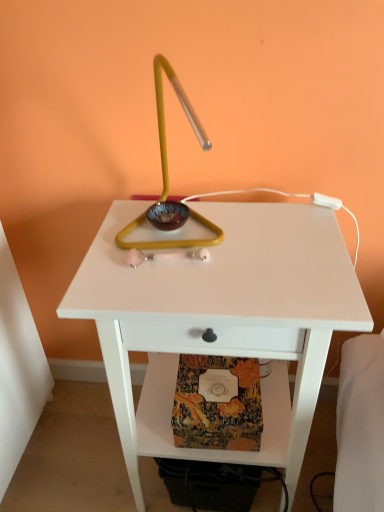
Locate an element on the screen. The image size is (384, 512). vacant space that is to the left of white wood nightstand at center is located at coordinates (76, 445).